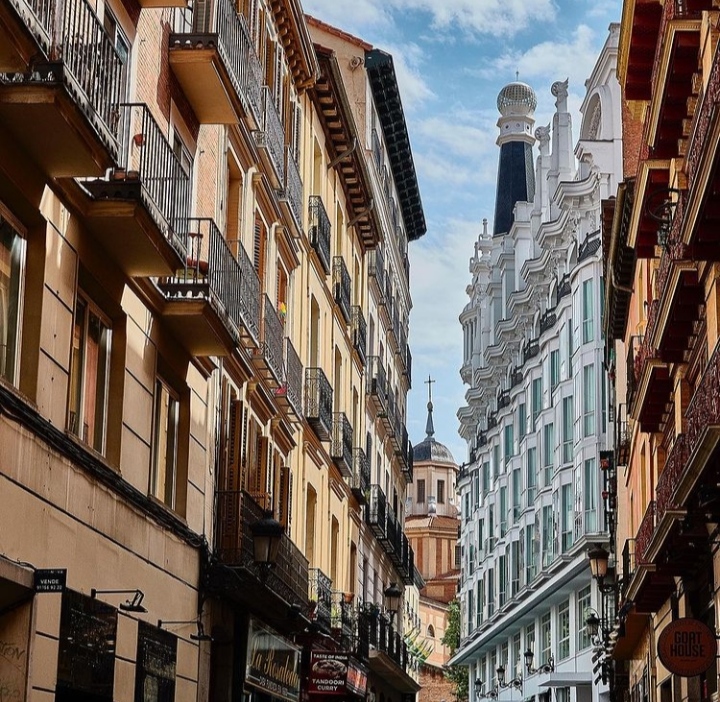
At what (x,y) coordinates should I click in order to perform the action: click on leftmost lantern. Please return your answer as a coordinate pair (x, y). Image resolution: width=720 pixels, height=702 pixels. Looking at the image, I should click on (263, 542).